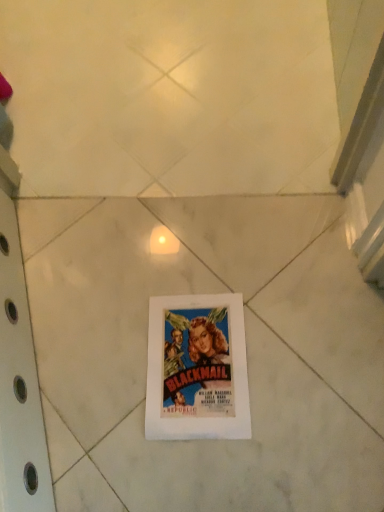
Find the location of a particular element. vacant space behind white paper at center is located at coordinates (175, 261).